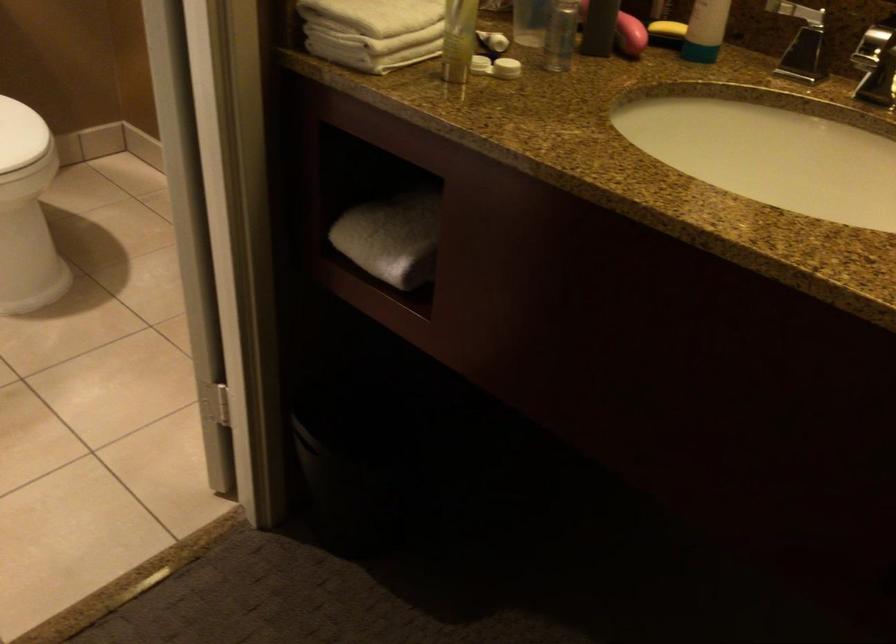
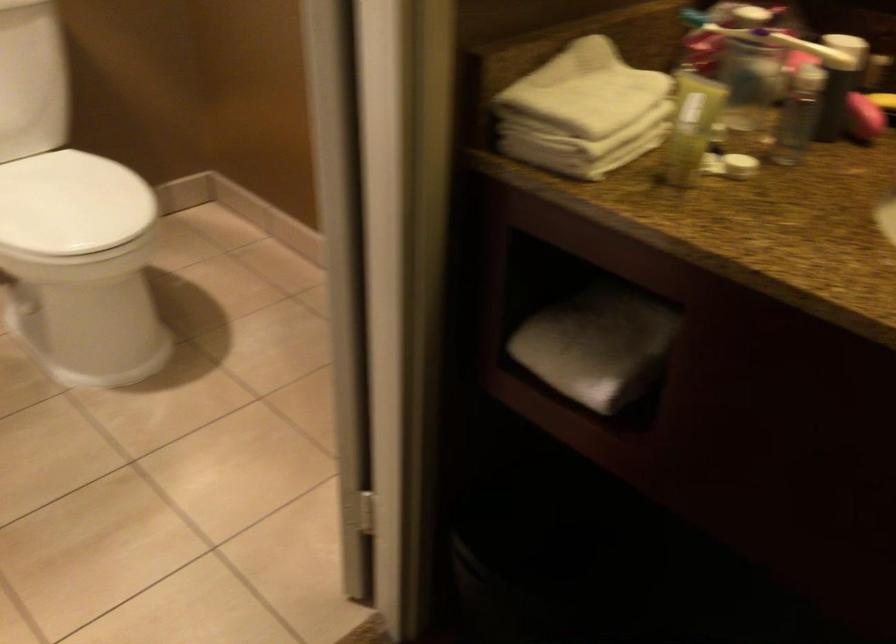
Question: The camera is either moving clockwise (left) or counter-clockwise (right) around the object. The first image is from the beginning of the video and the second image is from the end. Is the camera moving left or right when shooting the video?

Choices:
 (A) Left
 (B) Right

Answer: (B)